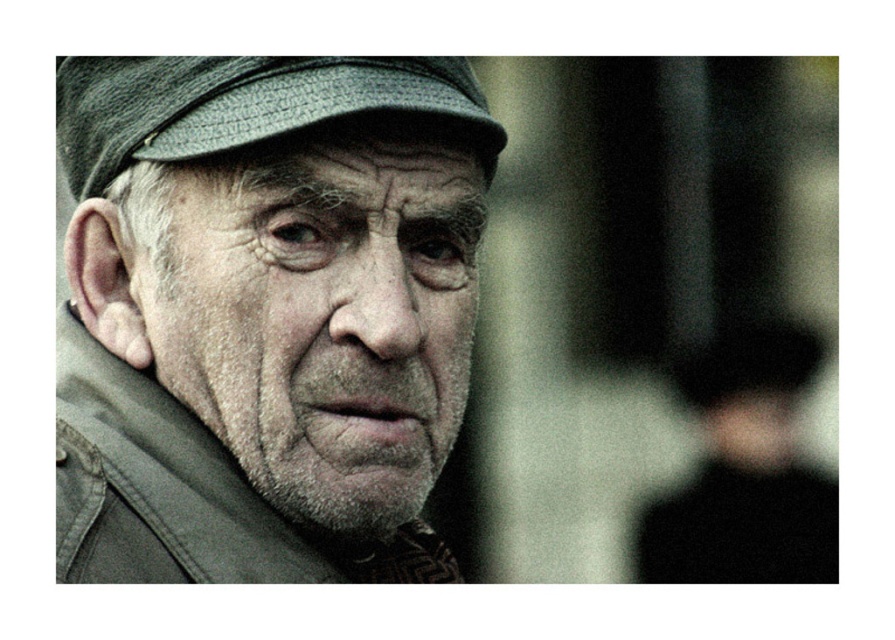
What are the coordinates of the matte gray cap at center in the image?

The coordinates of the matte gray cap at center are at point [320,312].

From the picture: You are a costume designer preparing for a historical drama. You have two headpieces to choose from in the image. The matte gray cap at center and the textured gray beret at upper left. Which headpiece has a smaller width when viewed from the front?

The matte gray cap at center is thinner than the textured gray beret at upper left, so the matte gray cap at center has a smaller width when viewed from the front.